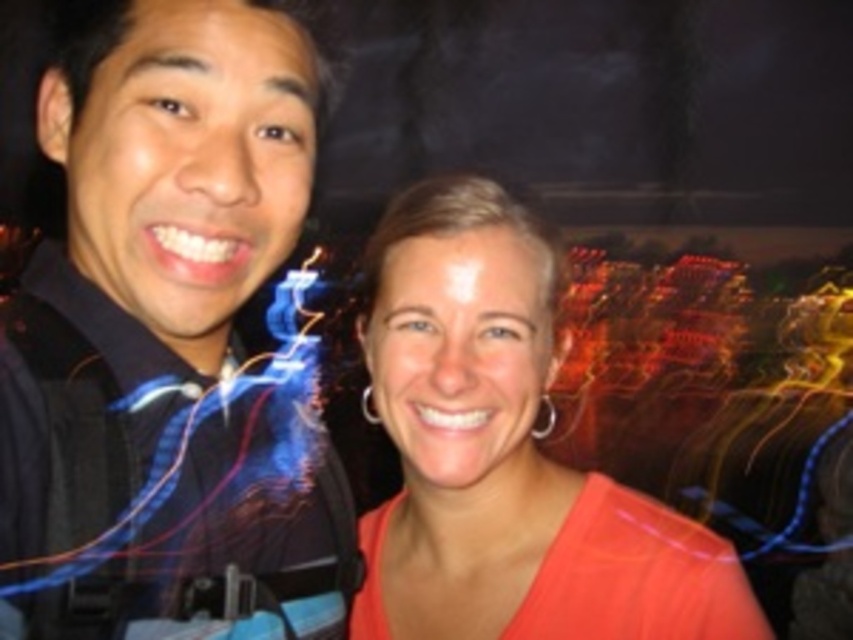
Based on the photo, you are a photographer trying to capture a group photo. You need to arrange two people so that the black matte shirt at left is positioned to the left of the orange matte shirt at center. Given the current setup, is the arrangement correct according to the image?

Yes, the arrangement is correct because the black matte shirt at left is already positioned to the left of the orange matte shirt at center as shown in the image.

You are a photographer trying to adjust the focus of your camera to capture both the black matte shirt at left and the orange matte shirt at center clearly. Since the shirts are different in size, which one should you focus on first to ensure the main subject is sharp?

The black matte shirt at left is smaller than the orange matte shirt at center, so you should focus on the orange matte shirt at center first as it is larger and likely the main subject.

You are a photographer trying to adjust the lighting for a photo shoot. You notice the black matte shirt at left and the orange matte shirt at center. Which shirt should you focus on if you want to highlight the top of the person wearing it?

The orange matte shirt at center is taller than the black matte shirt at left, so focusing on the orange matte shirt at center would better highlight the top of the person wearing it since it reaches higher.